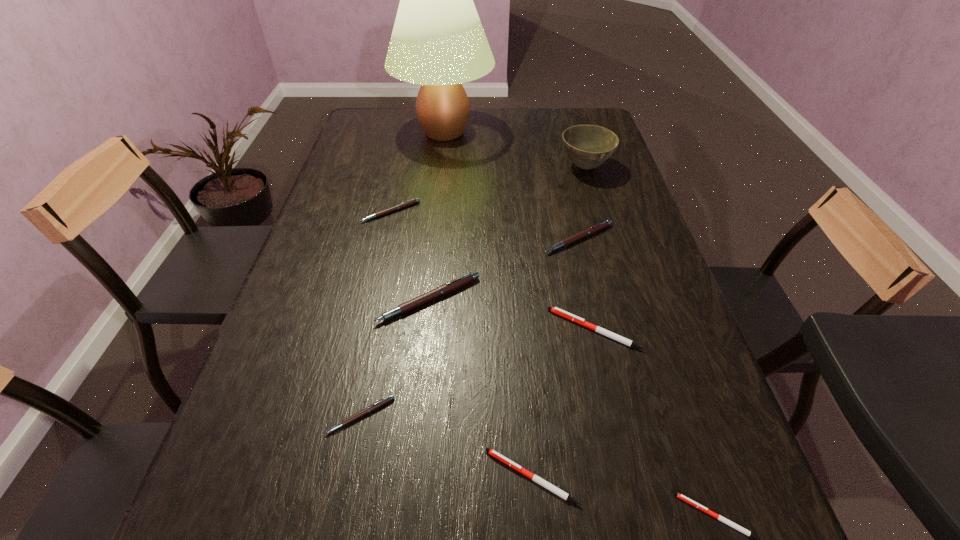
You are a GUI agent. You are given a task and a screenshot of the screen. Output one action in this format:
    pyautogui.click(x=<x>, y=<y>)
    Task: Click on the third nearest pen
    
    Given the screenshot: What is the action you would take?
    pyautogui.click(x=374, y=406)

Where is `the second smallest white pen`? the second smallest white pen is located at coordinates (534, 477).

Locate an element on the screen. This screenshot has height=540, width=960. vacant area situated on the shade of the lampshade is located at coordinates (433, 231).

Locate an element on the screen. This screenshot has width=960, height=540. free space located 0.270m on the back of the eighth shortest object is located at coordinates point(569,116).

The image size is (960, 540). I want to click on vacant space located at the nib of the third farthest pink pen, so click(x=410, y=475).

This screenshot has width=960, height=540. I want to click on free space located 0.180m at the nib of the sixth shortest pen, so click(x=595, y=309).

You are a GUI agent. You are given a task and a screenshot of the screen. Output one action in this format:
    pyautogui.click(x=<x>, y=<y>)
    Task: Click on the vacant space situated at the nib of the second smallest pink pen
    
    Given the screenshot: What is the action you would take?
    pyautogui.click(x=374, y=287)

This screenshot has height=540, width=960. What are the coordinates of `blank space located 0.130m on the clicker of the farthest white pen` in the screenshot? It's located at (491, 329).

Find the location of `blank space located 0.360m on the clicker of the farthest white pen`. blank space located 0.360m on the clicker of the farthest white pen is located at coordinates point(385,329).

Image resolution: width=960 pixels, height=540 pixels. In order to click on vacant space located on the clicker of the farthest white pen in this screenshot , I will do `click(408, 329)`.